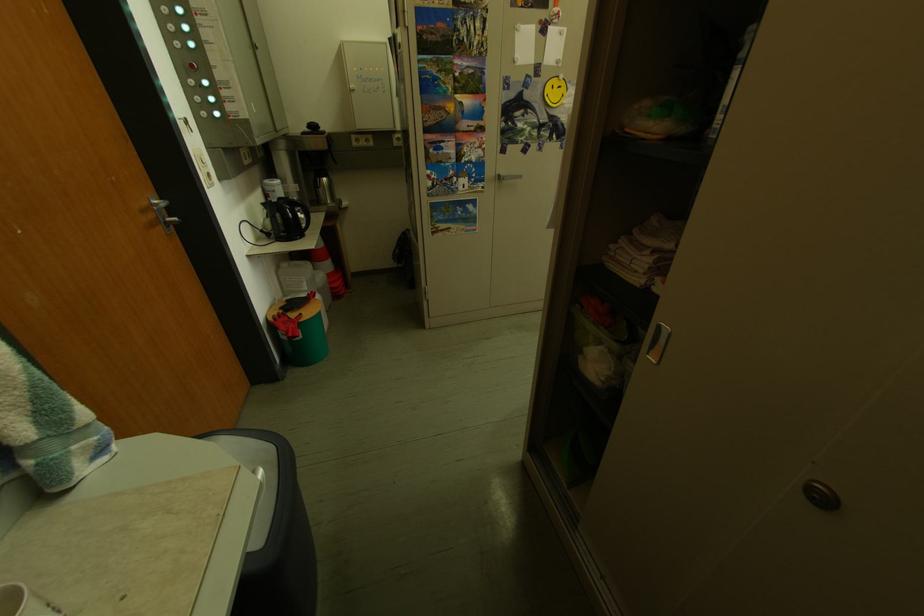
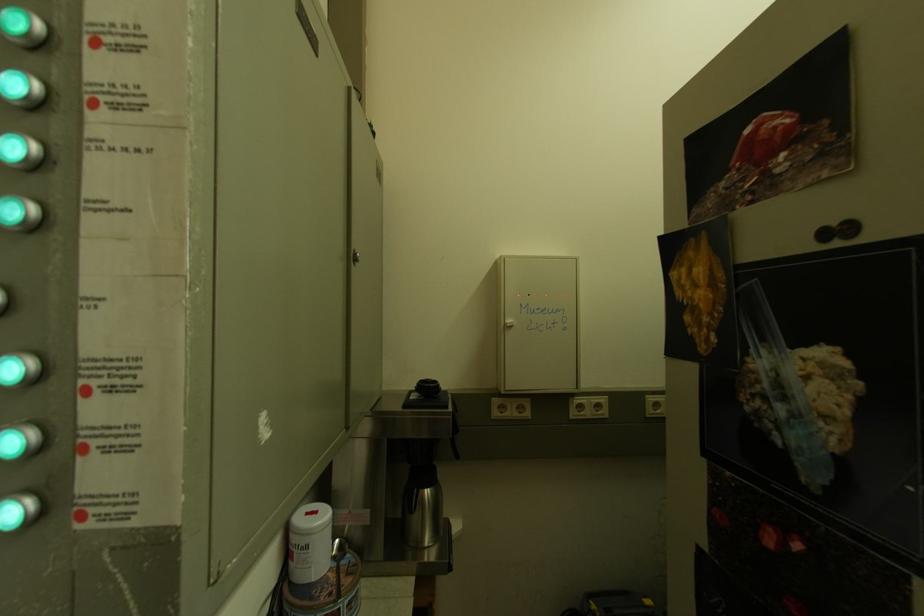
Find the pixel in the second image that matches the point at 367,92 in the first image.

(524, 330)